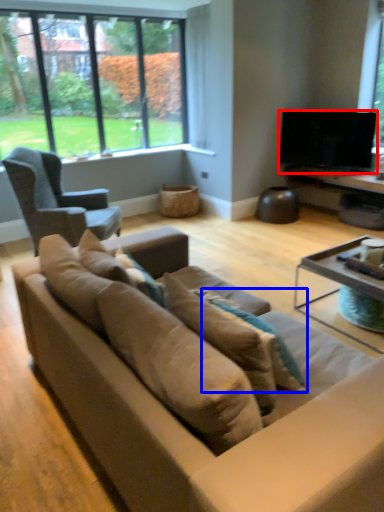
Question: Which of the following is the closest to the observer, television (highlighted by a red box) or pillow (highlighted by a blue box)?

Choices:
 (A) television
 (B) pillow

Answer: (B)